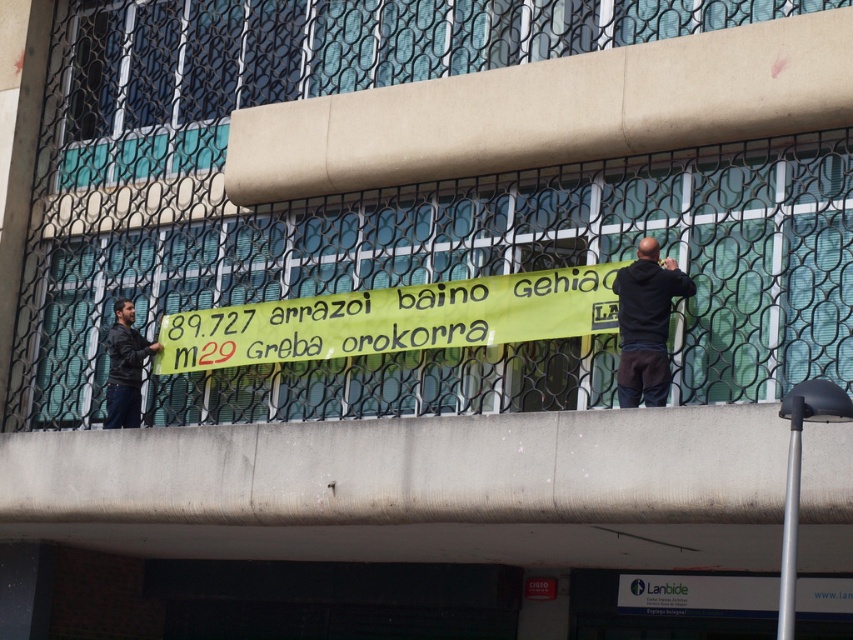
You are a photographer standing on a balcony. You want to take a photo of the yellow fabric banner at center and the black hoodie at right. Based on their positions, which object will appear larger in the photo?

The yellow fabric banner at center appears larger in the photo because it is located above the black hoodie at right, meaning it is closer to the camera.